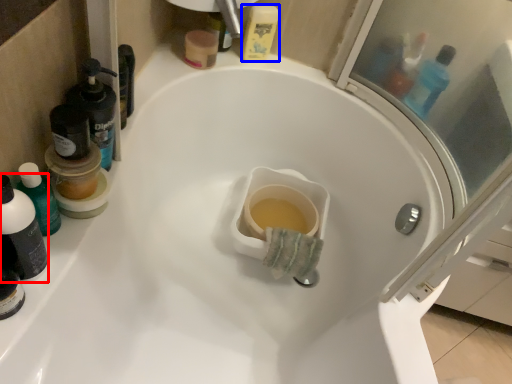
Question: Which object is further to the camera taking this photo, mouthwash (highlighted by a red box) or mouthwash (highlighted by a blue box)?

Choices:
 (A) mouthwash
 (B) mouthwash

Answer: (B)